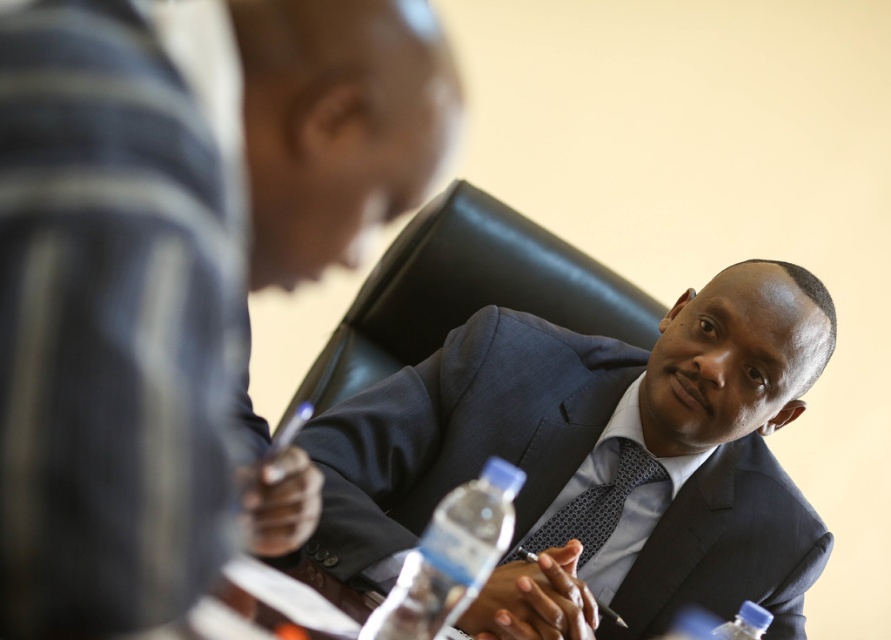
Question: Which object is closer to the camera taking this photo?

Choices:
 (A) dark blue textured tie at center
 (B) dark blue textured suit at center

Answer: (B)

Question: From the image, what is the correct spatial relationship of dark blue textured suit at center in relation to dark blue textured tie at center?

Choices:
 (A) left
 (B) right

Answer: (A)

Question: Which object is farther from the camera taking this photo?

Choices:
 (A) dark blue textured suit at center
 (B) dark blue textured tie at center

Answer: (B)

Question: Can you confirm if dark blue textured suit at center is bigger than dark blue textured tie at center?

Choices:
 (A) yes
 (B) no

Answer: (A)

Question: Which point is closer to the camera taking this photo?

Choices:
 (A) (630, 442)
 (B) (500, 508)

Answer: (B)

Question: Does dark blue textured suit at center have a larger size compared to dark blue textured tie at center?

Choices:
 (A) no
 (B) yes

Answer: (B)